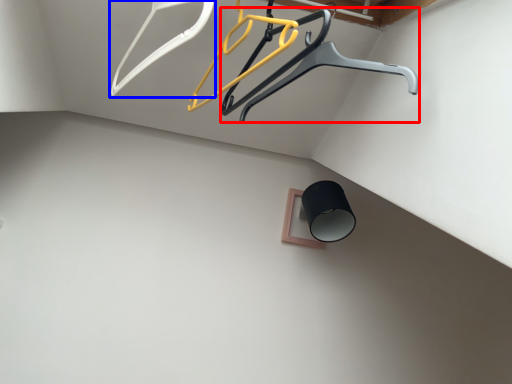
Question: Which of the following is the farthest to the observer, furniture (highlighted by a red box) or hanger (highlighted by a blue box)?

Choices:
 (A) furniture
 (B) hanger

Answer: (A)